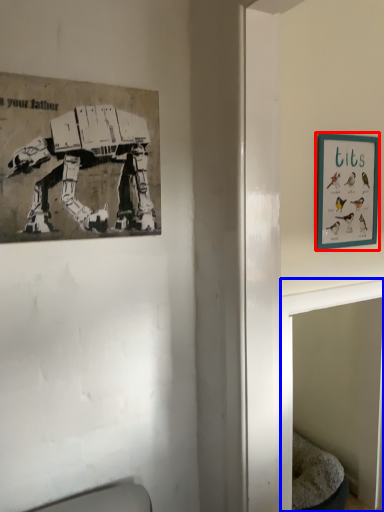
Question: Which of the following is the closest to the observer, picture frame (highlighted by a red box) or table (highlighted by a blue box)?

Choices:
 (A) picture frame
 (B) table

Answer: (B)